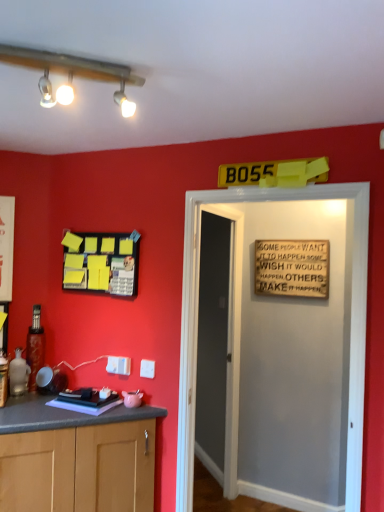
Question: Considering the positions of point coord(188,304) and point coord(127,264), is point coord(188,304) closer or farther from the camera than point coord(127,264)?

Choices:
 (A) closer
 (B) farther

Answer: (A)

Question: In terms of width, does wooden signboard at center, which is the 1th door in front-to-back order, look wider or thinner when compared to yellow matte bulletin board at upper left?

Choices:
 (A) wide
 (B) thin

Answer: (A)

Question: Which of these objects is positioned closest to the wooden sign at upper center?

Choices:
 (A) wooden signboard at center, the 2th door viewed from the back
 (B) smooth gray door at center, the second door in the front-to-back sequence
 (C) yellow matte bulletin board at upper left

Answer: (B)

Question: Which of these objects is positioned closest to the wooden signboard at center, the 2th door viewed from the back?

Choices:
 (A) yellow matte bulletin board at upper left
 (B) smooth gray door at center, positioned as the 1th door in back-to-front order
 (C) wooden sign at upper center

Answer: (A)